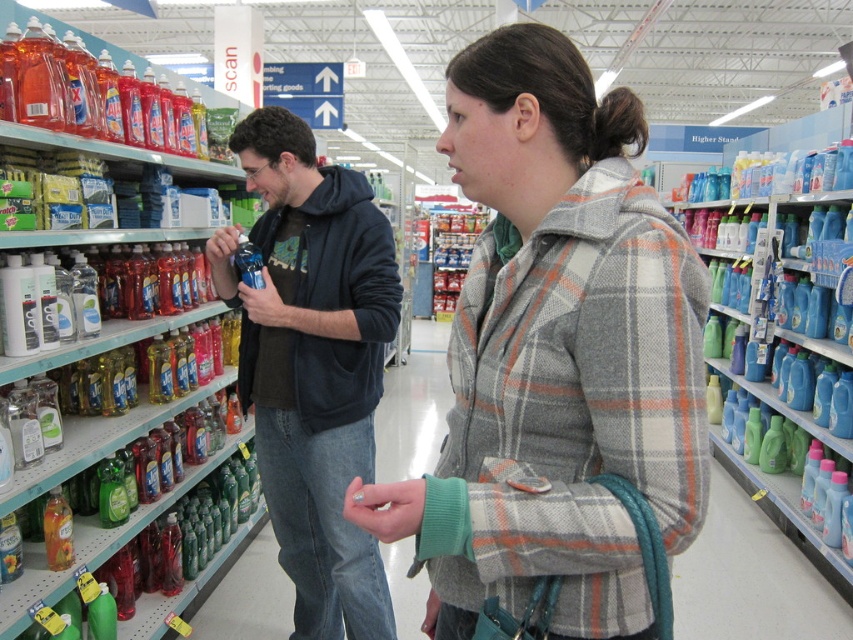
Question: Can you confirm if plaid woolen jacket at center is positioned to the right of translucent plastic bottles at left?

Choices:
 (A) yes
 (B) no

Answer: (A)

Question: Considering the relative positions of plaid woolen jacket at center and blue plastic detergent bottles at right in the image provided, where is plaid woolen jacket at center located with respect to blue plastic detergent bottles at right?

Choices:
 (A) right
 (B) left

Answer: (B)

Question: Which point is farther to the camera?

Choices:
 (A) blue plastic detergent bottles at right
 (B) plaid woolen jacket at center
 (C) translucent plastic bottles at left
 (D) dark blue hoodie at center

Answer: (A)

Question: Which point is farther to the camera?

Choices:
 (A) plaid woolen jacket at center
 (B) translucent plastic bottles at left
 (C) dark blue hoodie at center
 (D) blue plastic detergent bottles at right

Answer: (D)

Question: Which object is the closest to the plaid woolen jacket at center?

Choices:
 (A) dark blue hoodie at center
 (B) blue plastic detergent bottles at right
 (C) translucent plastic bottles at left

Answer: (A)

Question: Considering the relative positions of dark blue hoodie at center and blue plastic detergent bottles at right in the image provided, where is dark blue hoodie at center located with respect to blue plastic detergent bottles at right?

Choices:
 (A) below
 (B) above

Answer: (A)